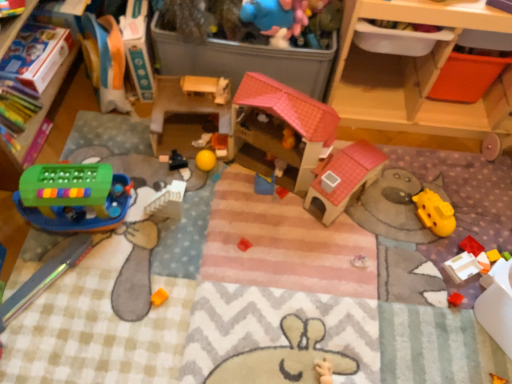
Find the location of a particular element. vacant area to the right of white matte figurine at center, arranged as the sixth toy when viewed from the right is located at coordinates (246, 165).